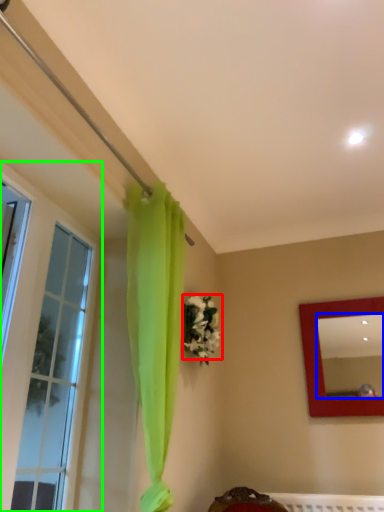
Question: Which object is positioned farthest from flower (highlighted by a red box)? Select from mirror (highlighted by a blue box) and window (highlighted by a green box).

Choices:
 (A) mirror
 (B) window

Answer: (A)